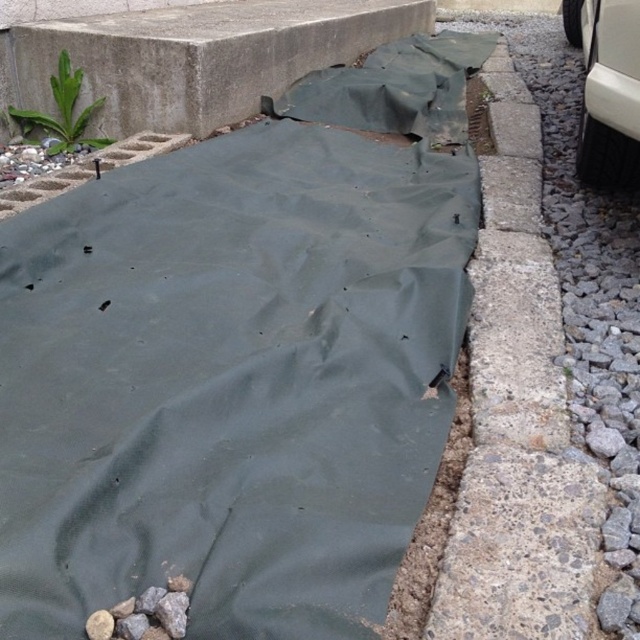
Is gray concrete curb at right positioned behind white matte car at right?

No.

Who is taller, gray concrete curb at right or white matte car at right?

gray concrete curb at right

At what (x,y) coordinates should I click in order to perform the action: click on gray concrete curb at right. Please return your answer as a coordinate pair (x, y). Looking at the image, I should click on (516, 417).

This screenshot has height=640, width=640. I want to click on gray concrete curb at right, so click(516, 417).

Does dark green tarp at center lie in front of gray concrete curb at right?

That is True.

Between point (148, 260) and point (508, 125), which one is positioned in front?

Point (148, 260) is more forward.

Identify the location of dark green tarp at center. (241, 360).

Who is positioned more to the left, dark green tarp at center or white matte car at right?

dark green tarp at center

This screenshot has width=640, height=640. What do you see at coordinates (241, 360) in the screenshot?
I see `dark green tarp at center` at bounding box center [241, 360].

I want to click on dark green tarp at center, so click(241, 360).